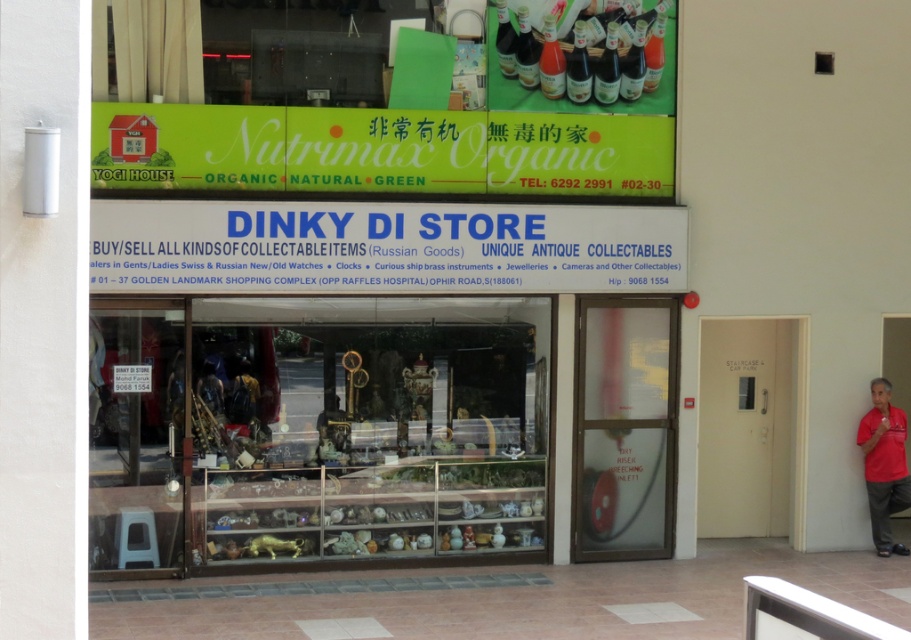
Is white matte door at right smaller than translucent glass bottle at upper center?

Actually, white matte door at right might be larger than translucent glass bottle at upper center.

Is white matte door at right further to the viewer compared to translucent glass bottle at upper center?

Yes, it is.

The height and width of the screenshot is (640, 911). What are the coordinates of `white matte door at right` in the screenshot? It's located at (749, 426).

Looking at this image, does white plastic signboard at center appear under white matte door at right?

No.

Is point (173, 214) positioned before point (738, 404)?

Yes, point (173, 214) is closer to viewer.

Who is more forward, (613, 232) or (776, 355)?

Point (613, 232)

Where is `white plastic signboard at center`? white plastic signboard at center is located at coordinates click(x=384, y=248).

Can you confirm if translucent plastic bottle at upper center is thinner than translucent glass bottle at upper center?

Incorrect, translucent plastic bottle at upper center's width is not less than translucent glass bottle at upper center's.

Is translucent plastic bottle at upper center in front of translucent glass bottle at upper center?

No, translucent plastic bottle at upper center is further to the viewer.

This screenshot has height=640, width=911. What do you see at coordinates (551, 61) in the screenshot?
I see `translucent plastic bottle at upper center` at bounding box center [551, 61].

Identify the location of translucent plastic bottle at upper center. This screenshot has height=640, width=911. (551, 61).